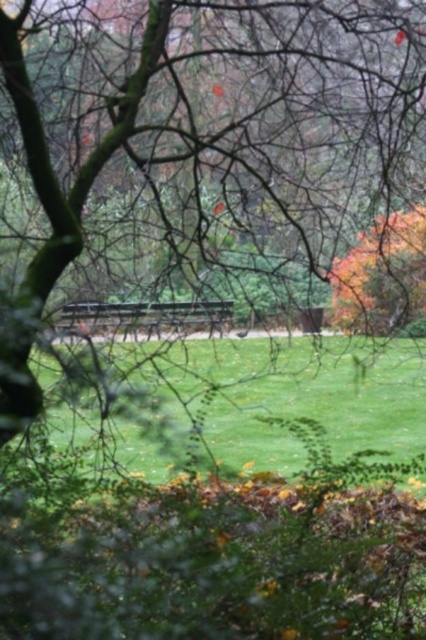
How distant is green grassy at center from wooden park bench at center?

green grassy at center is 7.33 feet from wooden park bench at center.

Can you confirm if green grassy at center is shorter than wooden park bench at center?

No, green grassy at center is not shorter than wooden park bench at center.

Is point (374, 384) positioned in front of point (227, 305)?

No, (374, 384) is further to viewer.

Locate an element on the screen. The height and width of the screenshot is (640, 426). green grassy at center is located at coordinates (302, 396).